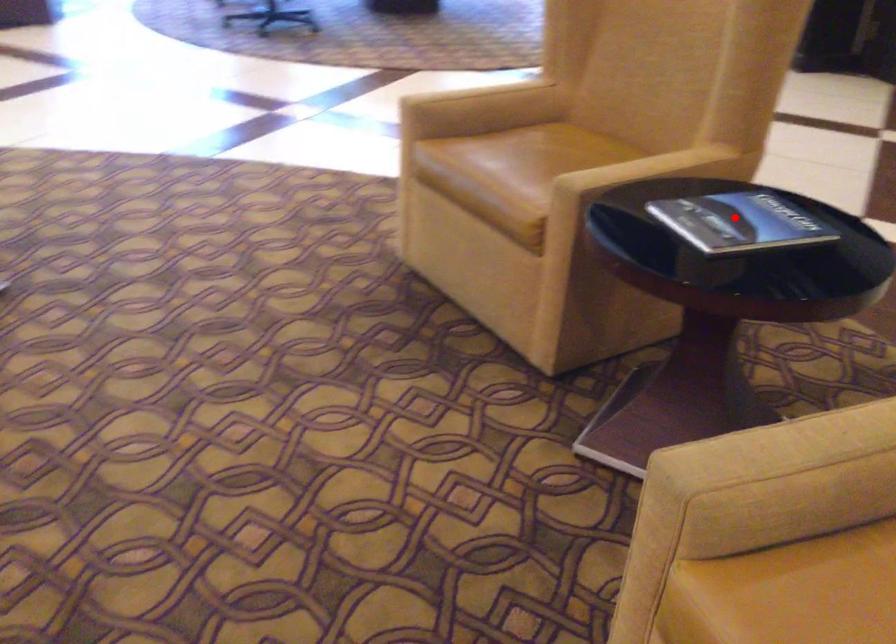
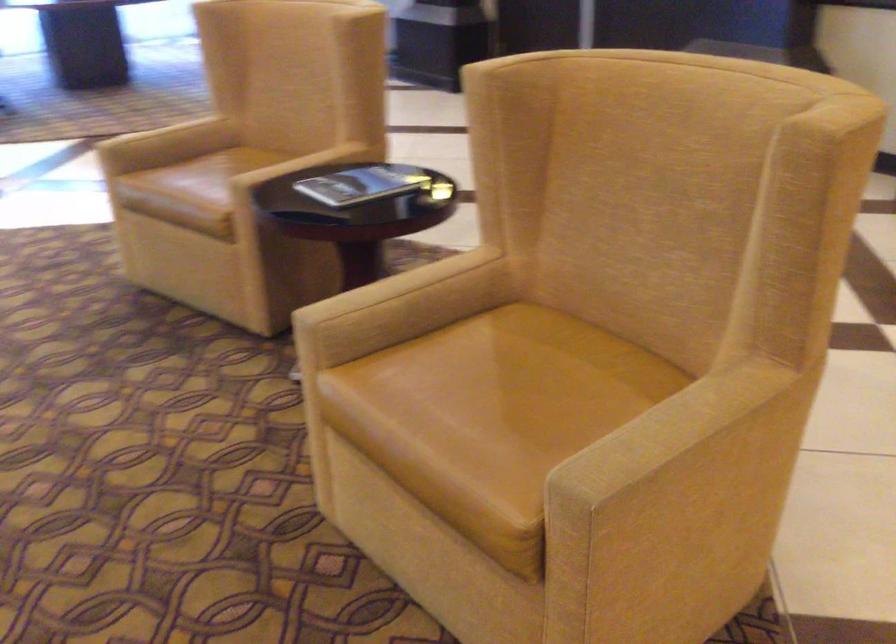
Question: A red point is marked in image1. In image2, is the corresponding 3D point closer to the camera or farther? Reply with the corresponding letter.

Choices:
 (A) The corresponding 3D point is closer.
 (B) The corresponding 3D point is farther.

Answer: (B)